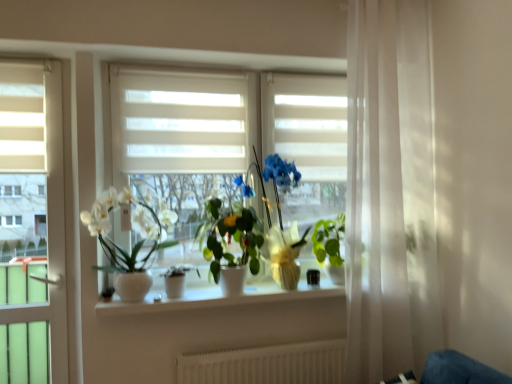
Question: Does matte white pot at center, the 3th houseplant when ordered from right to left, lie behind green glossy plant at center, which is the third houseplant in left-to-right order?

Choices:
 (A) no
 (B) yes

Answer: (B)

Question: Can you confirm if matte white pot at center, the 3th houseplant when ordered from right to left, is wider than green glossy plant at center, which is the third houseplant in left-to-right order?

Choices:
 (A) yes
 (B) no

Answer: (B)

Question: Is matte white pot at center, the 3th houseplant when ordered from right to left, smaller than green glossy plant at center, which appears as the second houseplant when viewed from the right?

Choices:
 (A) yes
 (B) no

Answer: (A)

Question: Is matte white pot at center, the 3th houseplant when ordered from right to left, at the left side of green glossy plant at center, which appears as the second houseplant when viewed from the right?

Choices:
 (A) yes
 (B) no

Answer: (A)

Question: From the image's perspective, is matte white pot at center, the 3th houseplant when ordered from right to left, under green glossy plant at center, which appears as the second houseplant when viewed from the right?

Choices:
 (A) yes
 (B) no

Answer: (A)

Question: Looking at the image, does green glossy plant at center, the 1th houseplant viewed from the right, seem bigger or smaller compared to white matte blind at upper left, acting as the second blind starting from the right?

Choices:
 (A) big
 (B) small

Answer: (A)

Question: From the image's perspective, relative to white matte blind at upper left, acting as the second blind starting from the right, is green glossy plant at center, which appears as the fourth houseplant when viewed from the left, above or below?

Choices:
 (A) above
 (B) below

Answer: (B)

Question: Considering the positions of green glossy plant at center, the 1th houseplant viewed from the right, and white matte blind at upper left, acting as the second blind starting from the right, in the image, is green glossy plant at center, the 1th houseplant viewed from the right, wider or thinner than white matte blind at upper left, acting as the second blind starting from the right,?

Choices:
 (A) wide
 (B) thin

Answer: (A)

Question: Based on their positions, is green glossy plant at center, the 1th houseplant viewed from the right, located to the left or right of white matte blind at upper left, the first blind positioned from the left?

Choices:
 (A) left
 (B) right

Answer: (B)

Question: Is matte white pot at center, the 3th houseplant when ordered from right to left, in front of or behind green glossy plant at center, which appears as the fourth houseplant when viewed from the left, in the image?

Choices:
 (A) front
 (B) behind

Answer: (A)

Question: Is point tap(162, 276) closer or farther from the camera than point tap(311, 238)?

Choices:
 (A) farther
 (B) closer

Answer: (B)

Question: Is matte white pot at center, the 3th houseplant when ordered from right to left, taller or shorter than green glossy plant at center, which appears as the fourth houseplant when viewed from the left?

Choices:
 (A) short
 (B) tall

Answer: (A)

Question: Is matte white pot at center, the 3th houseplant when ordered from right to left, spatially inside green glossy plant at center, the 1th houseplant viewed from the right, or outside of it?

Choices:
 (A) inside
 (B) outside

Answer: (B)

Question: Is matte white pot at center, the 3th houseplant when ordered from right to left, taller or shorter than white matte blind at upper left, which is the first blind from front to back?

Choices:
 (A) short
 (B) tall

Answer: (A)

Question: Do you think matte white pot at center, which is the 2th houseplant from left to right, is within white matte blind at upper left, acting as the second blind starting from the right, or outside of it?

Choices:
 (A) inside
 (B) outside

Answer: (B)